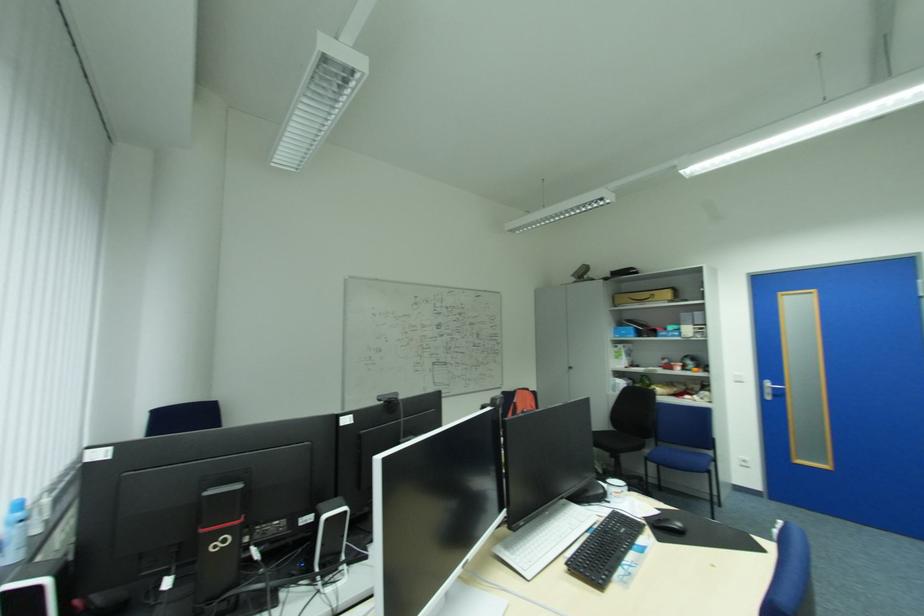
What do you see at coordinates (772, 386) in the screenshot? The width and height of the screenshot is (924, 616). I see `the silver door handle` at bounding box center [772, 386].